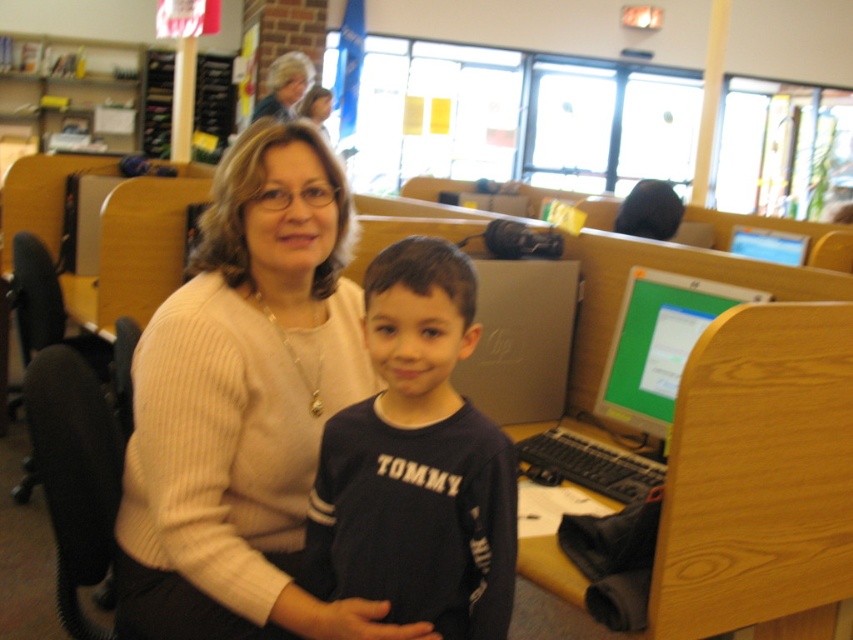
Looking at this image, you are standing in a library and see the light beige sweater at center. If you were to walk directly towards the sweater, which direction should you head?

The light beige sweater at center is located at point coordinates of 0.634 on the x axis and 0.287 on the y axis. Since the coordinates are given in a standard grid system where (0,0) is the bottom left corner, moving towards increasing x means moving to the right and increasing y means moving upwards. Therefore, to reach the sweater, you should head towards the right and slightly upwards from your current position.

Looking at this image, you are a photographer setting up for a group photo in the library. You need to ensure that both the dark blue jersey at center and the green glossy monitor at upper right are visible in the frame. Based on their positions, which object should you focus on first to include both in the shot?

The dark blue jersey at center is located below the green glossy monitor at upper right, so you should focus on the green glossy monitor at upper right first to ensure both are in the frame.